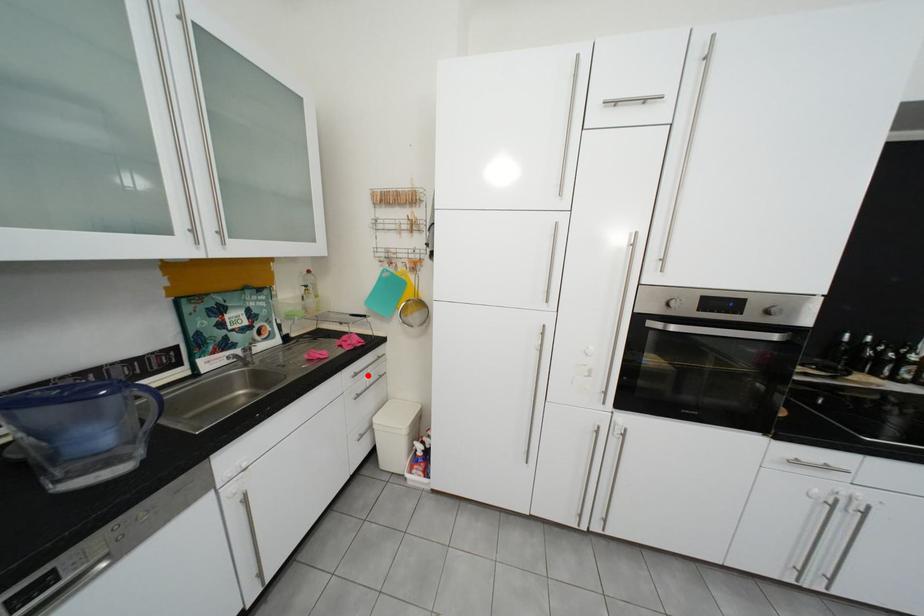
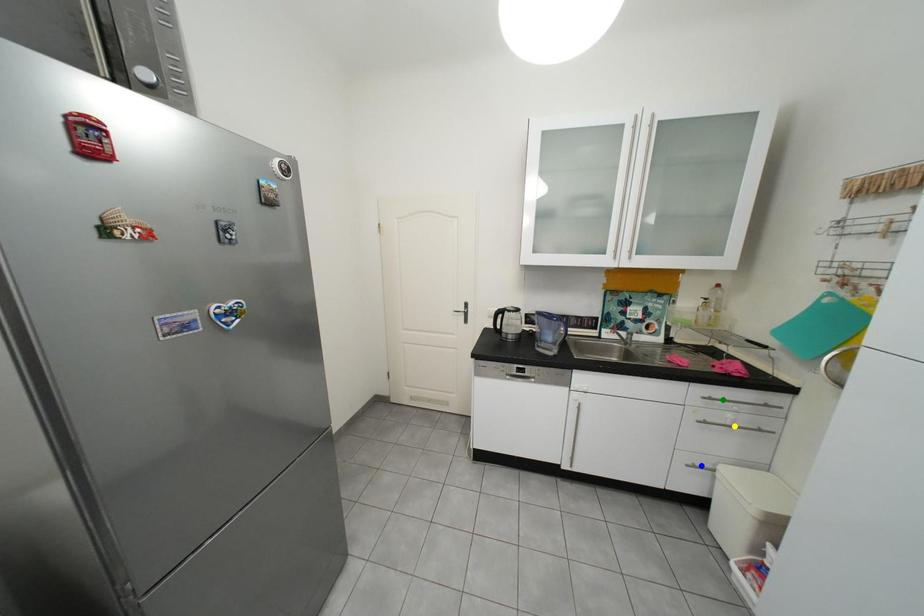
Question: I am providing you with two images of the same scene from different viewpoints. A red point is marked on the first image. You are given multiple points on the second image. Which point in image 2 represents the same 3d spot as the red point in image 1?

Choices:
 (A) blue point
 (B) yellow point
 (C) green point

Answer: (C)